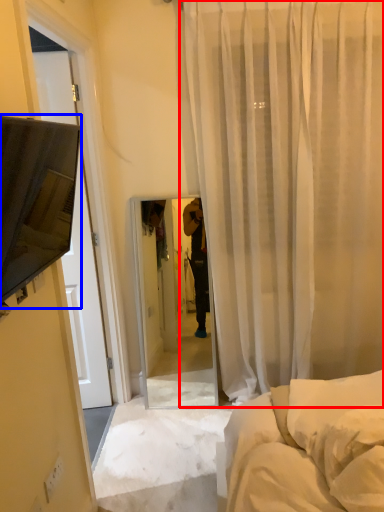
Question: Which object appears closest to the camera in this image, curtain (highlighted by a red box) or canopy bed (highlighted by a blue box)?

Choices:
 (A) curtain
 (B) canopy bed

Answer: (B)